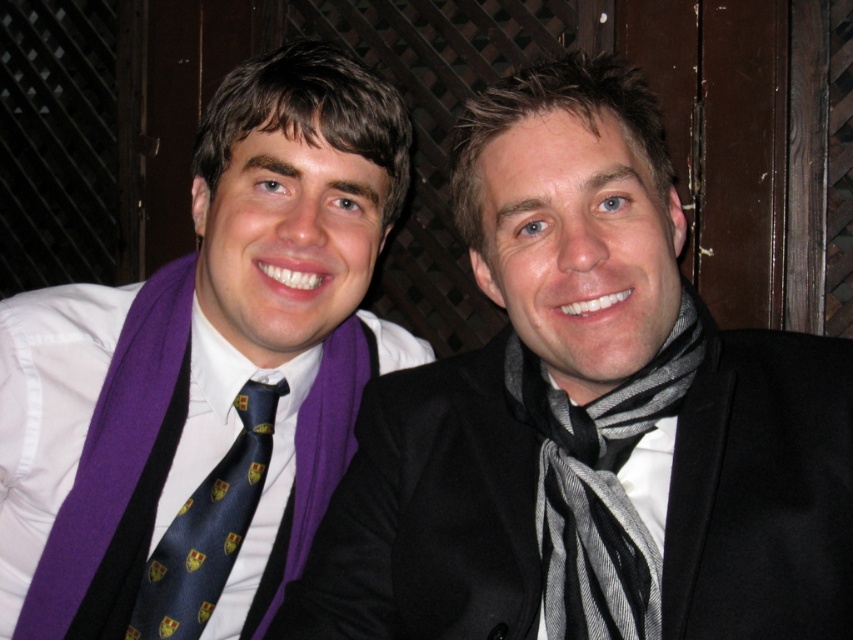
Which is more to the left, purple matte scarf at left or dark blue silk tie at center?

dark blue silk tie at center is more to the left.

Can you confirm if purple matte scarf at left is bigger than dark blue silk tie at center?

Indeed, purple matte scarf at left has a larger size compared to dark blue silk tie at center.

Is point (15, 554) positioned after point (161, 628)?

Yes, it is.

Where is `purple matte scarf at left`? This screenshot has height=640, width=853. purple matte scarf at left is located at coordinates (206, 372).

Is purple fabric scarf at left positioned behind purple matte scarf at left?

No, purple fabric scarf at left is in front of purple matte scarf at left.

Who is more distant from viewer, (602, 627) or (329, 460)?

Positioned behind is point (329, 460).

This screenshot has height=640, width=853. In order to click on purple fabric scarf at left in this screenshot , I will do `click(589, 417)`.

Who is higher up, purple fabric scarf at left or dark blue silk tie at center?

purple fabric scarf at left is higher up.

Who is more forward, (471,564) or (230,547)?

Point (471,564) is in front.

Between point (711, 481) and point (126, 628), which one is positioned in front?

Point (711, 481)

This screenshot has height=640, width=853. I want to click on purple fabric scarf at left, so click(x=589, y=417).